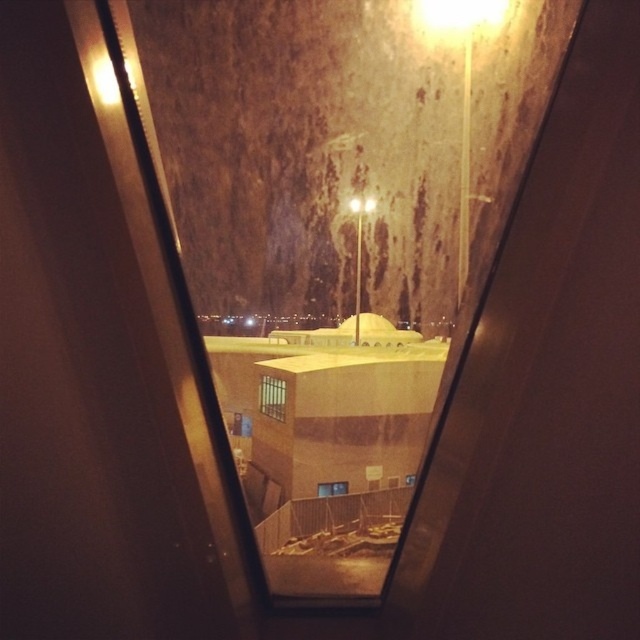
Question: Is clear glass window at center to the left of transparent glass window at center from the viewer's perspective?

Choices:
 (A) no
 (B) yes

Answer: (B)

Question: Observing the image, what is the correct spatial positioning of clear glass window at center in reference to transparent glass window at center?

Choices:
 (A) above
 (B) below

Answer: (A)

Question: Which of the following is the farthest from the observer?

Choices:
 (A) (339, 486)
 (B) (284, 400)

Answer: (A)

Question: Is clear glass window at center below transparent glass window at center?

Choices:
 (A) yes
 (B) no

Answer: (B)

Question: Which object appears closest to the camera in this image?

Choices:
 (A) clear glass window at center
 (B) transparent glass window at center

Answer: (A)